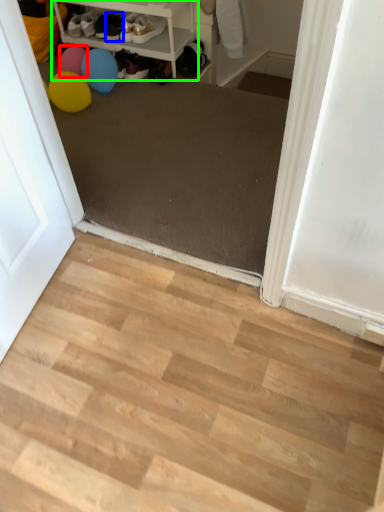
Question: Based on their relative distances, which object is farther from balloon (highlighted by a red box)? Choose from footwear (highlighted by a blue box) and shelf (highlighted by a green box).

Choices:
 (A) footwear
 (B) shelf

Answer: (B)